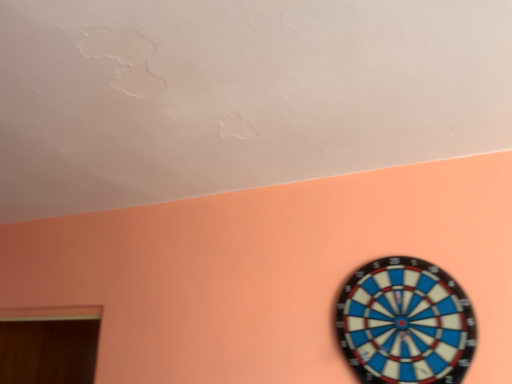
Question: Is point (76, 380) positioned closer to the camera than point (443, 379)?

Choices:
 (A) farther
 (B) closer

Answer: (A)

Question: In terms of height, does wooden door at lower left look taller or shorter compared to blue plastic dartboard at lower right?

Choices:
 (A) short
 (B) tall

Answer: (B)

Question: Choose the correct answer: Is wooden door at lower left inside blue plastic dartboard at lower right or outside it?

Choices:
 (A) inside
 (B) outside

Answer: (B)

Question: Based on their positions, is blue plastic dartboard at lower right located to the left or right of wooden door at lower left?

Choices:
 (A) right
 (B) left

Answer: (A)

Question: Considering the positions of blue plastic dartboard at lower right and wooden door at lower left in the image, is blue plastic dartboard at lower right wider or thinner than wooden door at lower left?

Choices:
 (A) thin
 (B) wide

Answer: (A)

Question: Is blue plastic dartboard at lower right situated inside wooden door at lower left or outside?

Choices:
 (A) inside
 (B) outside

Answer: (B)

Question: From a real-world perspective, is blue plastic dartboard at lower right physically located above or below wooden door at lower left?

Choices:
 (A) below
 (B) above

Answer: (B)